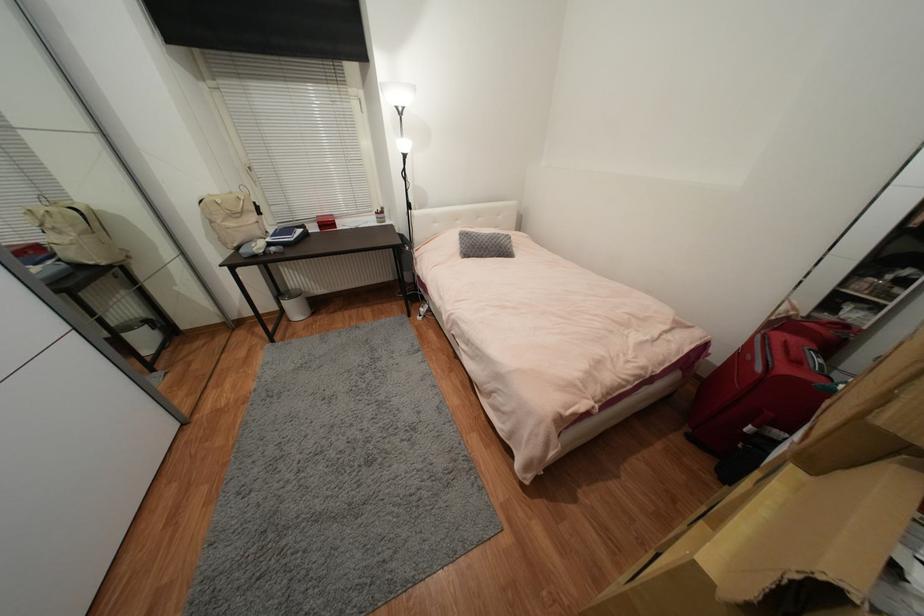
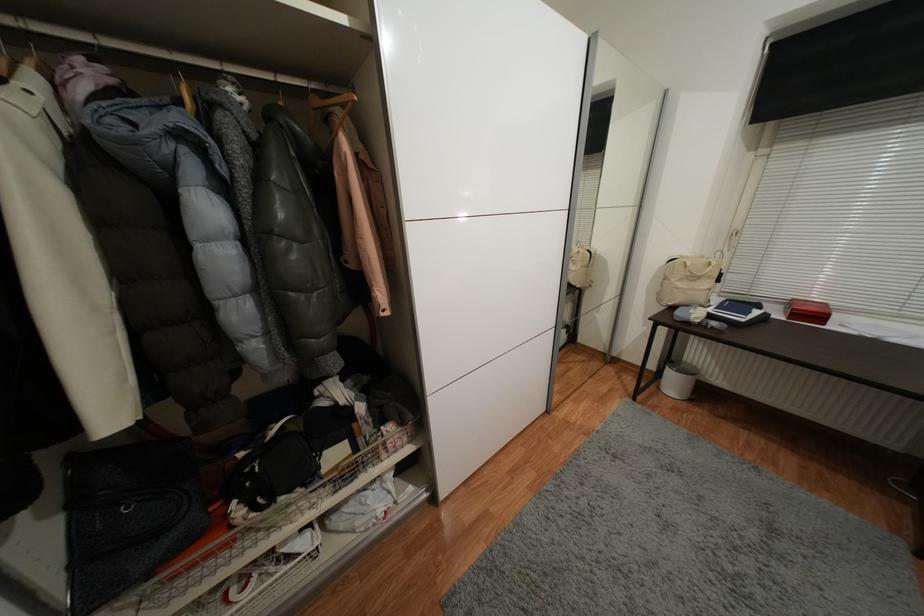
Question: How did the camera likely rotate?

Choices:
 (A) Left
 (B) Right
 (C) Up
 (D) Down

Answer: (A)